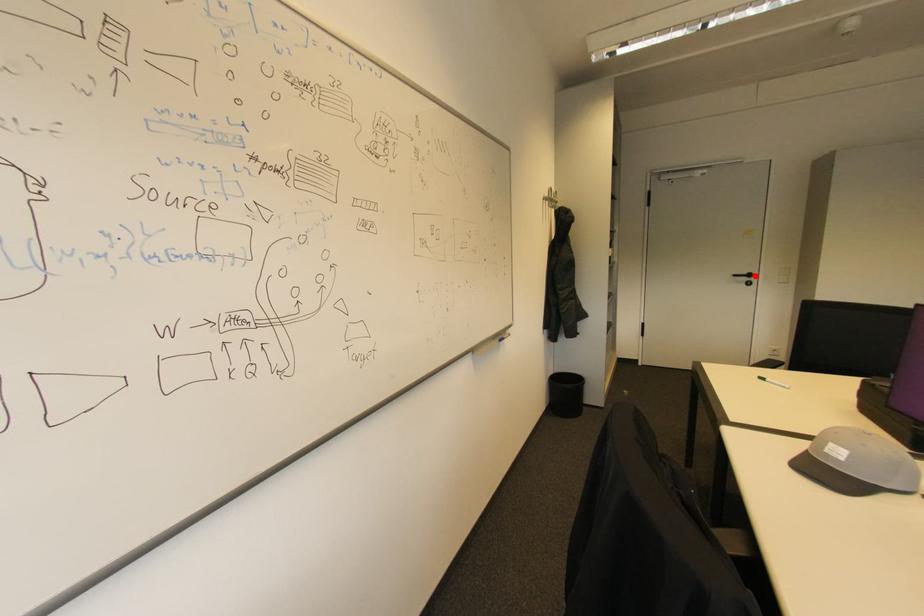
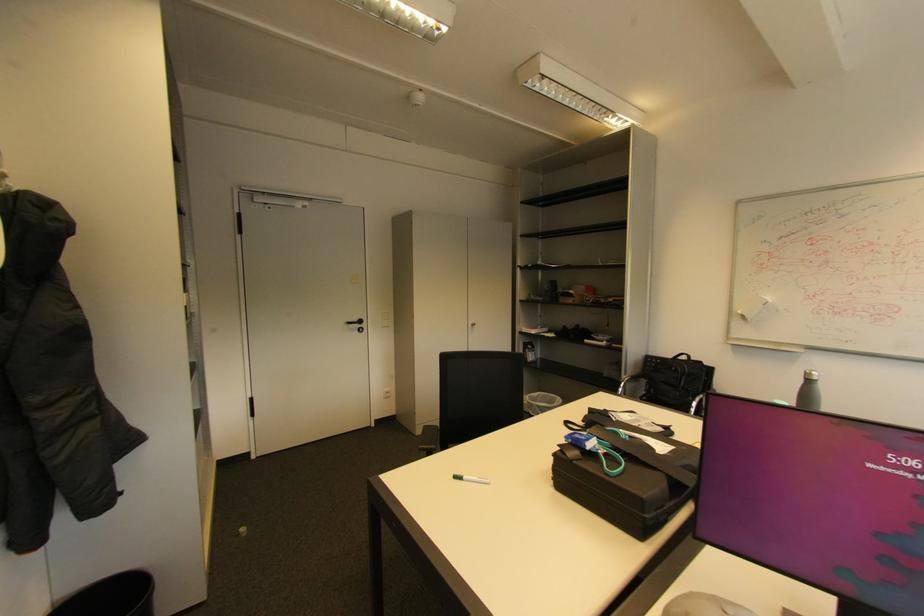
The point at the highlighted location is marked in the first image. Where is the corresponding point in the second image?

(366, 322)